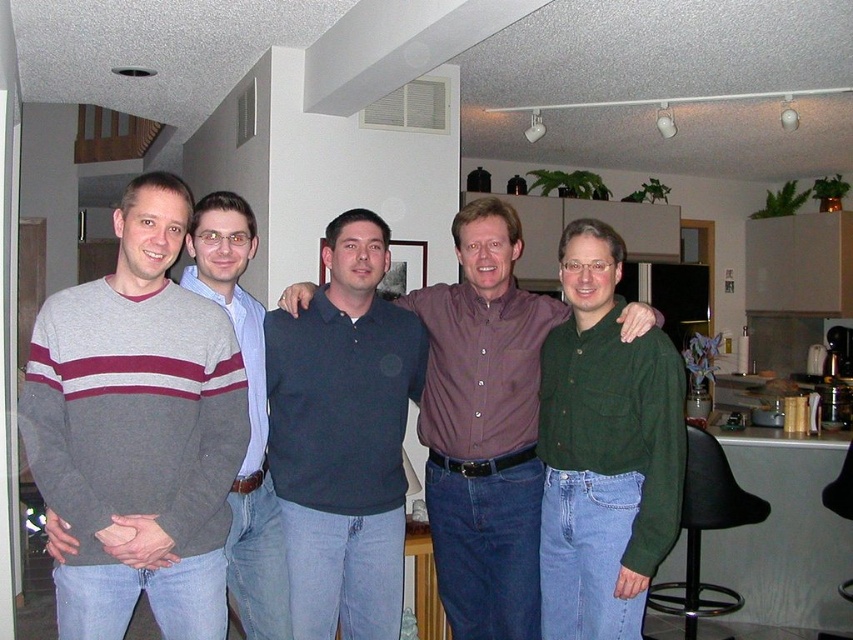
Question: Which of the following is the closest to the observer?

Choices:
 (A) (349, 220)
 (B) (467, 408)

Answer: (A)

Question: Which of these objects is positioned farthest from the gray sweater at center?

Choices:
 (A) green cotton shirt at center
 (B) dark blue polo shirt at center

Answer: (A)

Question: Which of the following is the farthest from the observer?

Choices:
 (A) gray sweater at center
 (B) gray striped sweater at left
 (C) dark blue polo shirt at center

Answer: (C)

Question: Does dark blue polo shirt at center have a lesser width compared to gray sweater at center?

Choices:
 (A) no
 (B) yes

Answer: (A)

Question: Can you confirm if gray striped sweater at left is smaller than gray sweater at center?

Choices:
 (A) no
 (B) yes

Answer: (B)

Question: Is dark blue polo shirt at center above dark blue shirt at center?

Choices:
 (A) no
 (B) yes

Answer: (A)